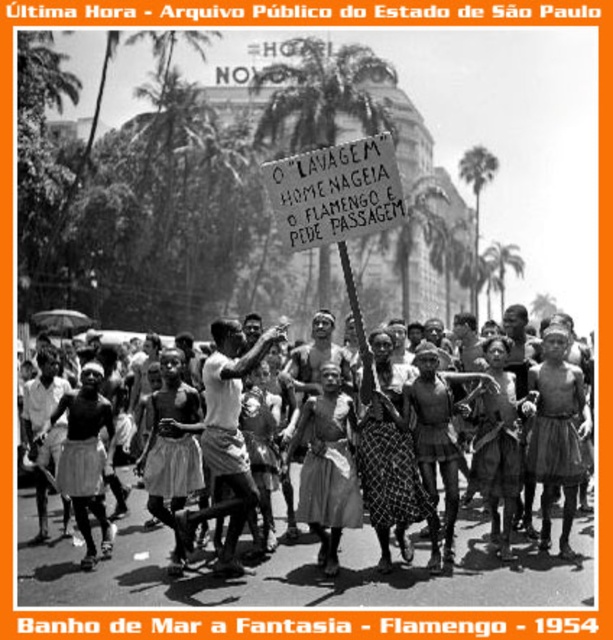
Does dark skin human at center have a lesser height compared to light brown fabric skirt at center?

Incorrect, dark skin human at center's height does not fall short of light brown fabric skirt at center's.

Who is more forward, (481,396) or (314,451)?

Point (314,451) is in front.

Between point (246, 544) and point (322, 472), which one is positioned in front?

Point (322, 472)

Where is `dark skin human at center`? The width and height of the screenshot is (613, 640). dark skin human at center is located at coordinates (139, 548).

Who is taller, dark skin human at center or wooden signboard at center?

dark skin human at center

Does dark skin human at center appear on the left side of wooden signboard at center?

Correct, you'll find dark skin human at center to the left of wooden signboard at center.

Measure the distance between point (316, 552) and camera.

A distance of 207.74 feet exists between point (316, 552) and camera.

This screenshot has width=613, height=640. I want to click on dark skin human at center, so click(x=139, y=548).

In the scene shown: Between wooden signboard at center and light brown fabric skirt at center, which one is positioned higher?

wooden signboard at center

Does point (356, 150) come in front of point (329, 435)?

Yes, point (356, 150) is closer to viewer.

The image size is (613, 640). Identify the location of wooden signboard at center. (335, 193).